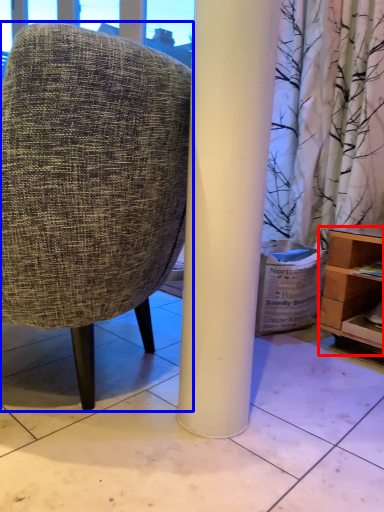
Question: Which of the following is the closest to the observer, shelf (highlighted by a red box) or chair (highlighted by a blue box)?

Choices:
 (A) shelf
 (B) chair

Answer: (B)